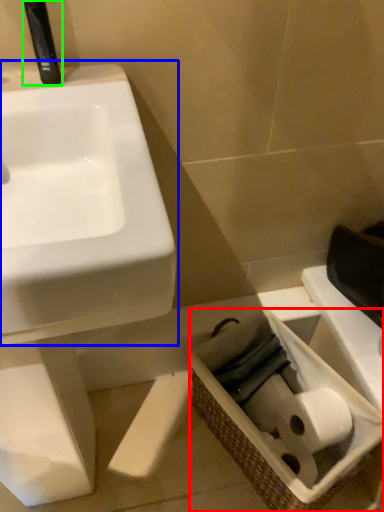
Question: Based on their relative distances, which object is nearer to basket (highlighted by a red box)? Choose from sink (highlighted by a blue box) and plumbing fixture (highlighted by a green box).

Choices:
 (A) sink
 (B) plumbing fixture

Answer: (A)